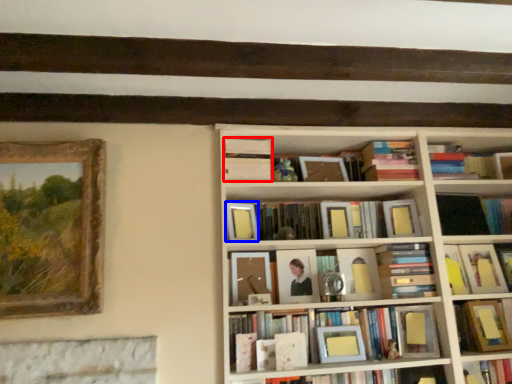
Question: Which object appears closest to the camera in this image, book (highlighted by a red box) or paperback book (highlighted by a blue box)?

Choices:
 (A) book
 (B) paperback book

Answer: (B)